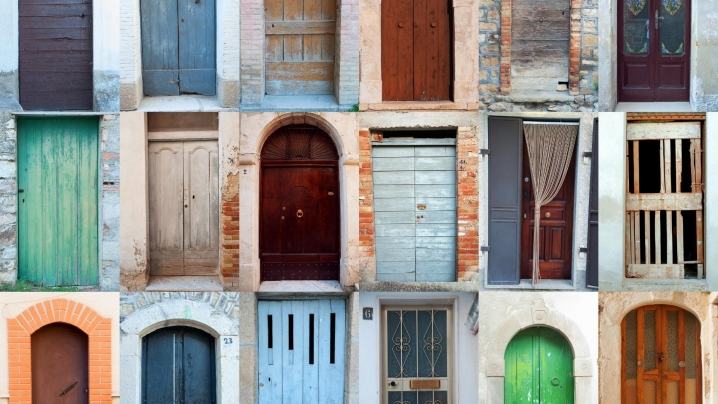
The width and height of the screenshot is (718, 404). Find the location of `doors in the middle`. doors in the middle is located at coordinates (302, 52), (416, 50), (418, 214), (299, 208), (303, 311), (413, 323).